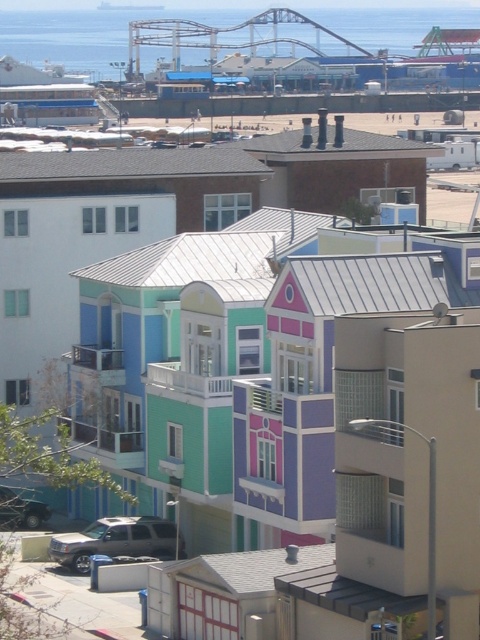
Which of these two, silver metallic suv at lower left or metallic silver car at lower left, stands shorter?

metallic silver car at lower left is shorter.

Is silver metallic suv at lower left above metallic silver car at lower left?

No.

Who is more distant from viewer, (72, 545) or (6, 504)?

The point (6, 504) is behind.

At what (x,y) coordinates should I click in order to perform the action: click on silver metallic suv at lower left. Please return your answer as a coordinate pair (x, y). Looking at the image, I should click on (113, 540).